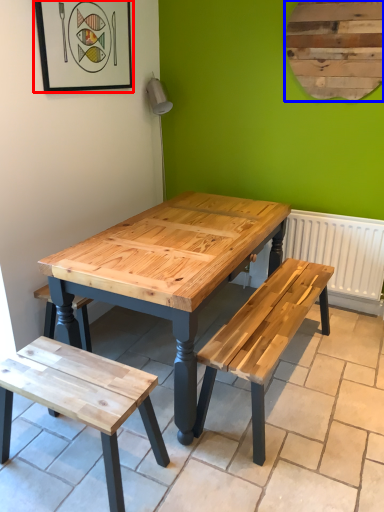
Question: Which object appears farthest to the camera in this image, picture frame (highlighted by a red box) or bulletin board (highlighted by a blue box)?

Choices:
 (A) picture frame
 (B) bulletin board

Answer: (B)